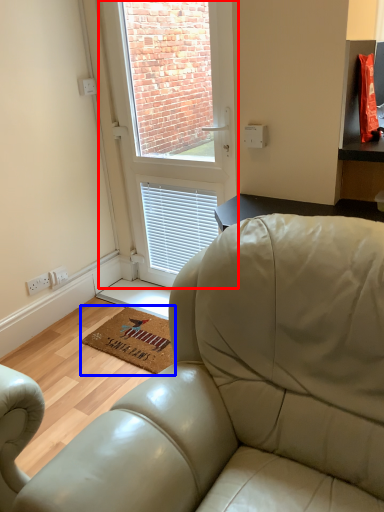
Question: Among these objects, which one is nearest to the camera, window (highlighted by a red box) or mat (highlighted by a blue box)?

Choices:
 (A) window
 (B) mat

Answer: (A)